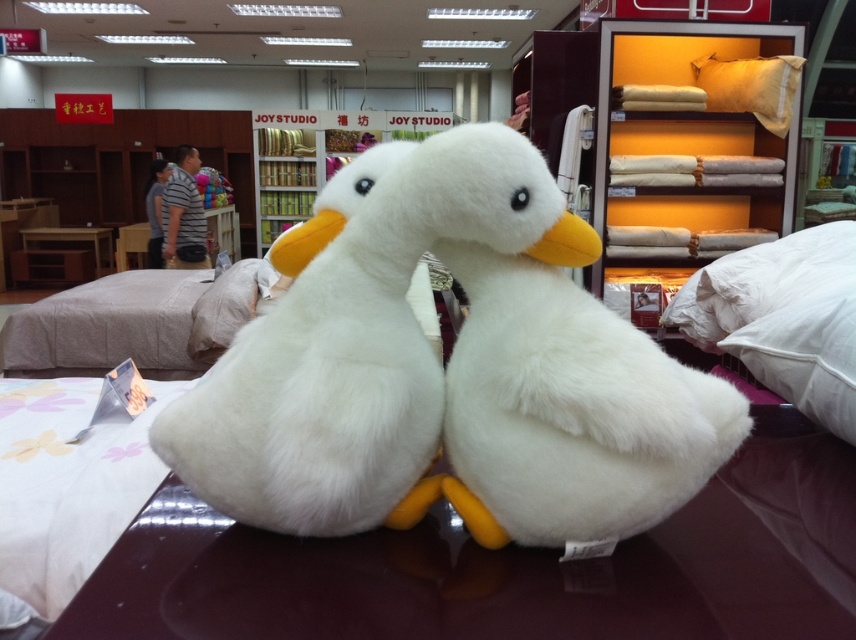
Which of these two, white plush duck at center or wooden table at center, stands shorter?

Standing shorter between the two is white plush duck at center.

Does point (516, 291) come closer to viewer compared to point (91, 240)?

Yes, it is in front of point (91, 240).

Is point (321, 401) more distant than point (70, 230)?

That is False.

The width and height of the screenshot is (856, 640). In order to click on white plush duck at center in this screenshot , I will do `click(453, 376)`.

What do you see at coordinates (229, 307) in the screenshot?
I see `white soft pillow at center` at bounding box center [229, 307].

Who is shorter, white soft pillow at center or white plush toy at center?

white soft pillow at center

In the scene shown: Who is more forward, [223,332] or [165,252]?

Point [223,332] is more forward.

Identify the location of white soft pillow at center. click(x=229, y=307).

The image size is (856, 640). What do you see at coordinates (752, 88) in the screenshot?
I see `beige soft pillow at upper right` at bounding box center [752, 88].

Who is positioned more to the left, beige soft pillow at upper right or wooden table at center?

From the viewer's perspective, wooden table at center appears more on the left side.

What do you see at coordinates (752, 88) in the screenshot?
I see `beige soft pillow at upper right` at bounding box center [752, 88].

At what (x,y) coordinates should I click in order to perform the action: click on beige soft pillow at upper right. Please return your answer as a coordinate pair (x, y). Looking at the image, I should click on point(752,88).